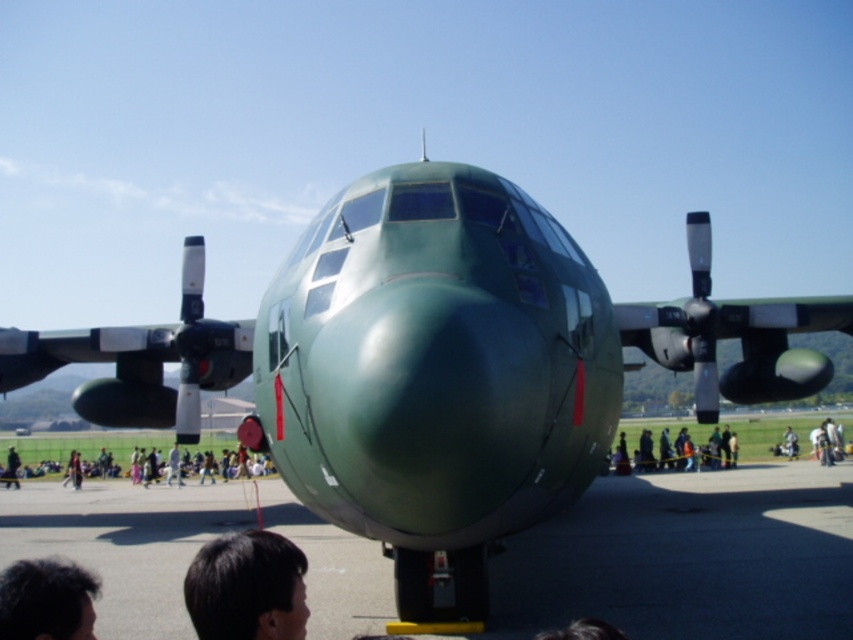
Does black hair at lower left lie in front of green matte airplane at center?

Yes, it is in front of green matte airplane at center.

Does black hair at lower left appear on the right side of green matte airplane at center?

Incorrect, black hair at lower left is not on the right side of green matte airplane at center.

Which is in front, point (248, 544) or point (668, 467)?

Point (248, 544) is more forward.

The width and height of the screenshot is (853, 640). I want to click on black hair at lower left, so click(x=247, y=588).

Is point (26, 632) positioned behind point (9, 461)?

No, (26, 632) is closer to viewer.

The image size is (853, 640). Find the location of `dark brown hair at lower left`. dark brown hair at lower left is located at coordinates pyautogui.click(x=45, y=600).

Is green matte tarmac at center wider than dark brown hair at lower center?

Yes, green matte tarmac at center is wider than dark brown hair at lower center.

Between point (497, 608) and point (537, 636), which one is positioned in front?

Positioned in front is point (537, 636).

Find the location of a particular element. green matte tarmac at center is located at coordinates (689, 557).

Find the location of a particular element. Image resolution: width=853 pixels, height=640 pixels. green matte tarmac at center is located at coordinates (689, 557).